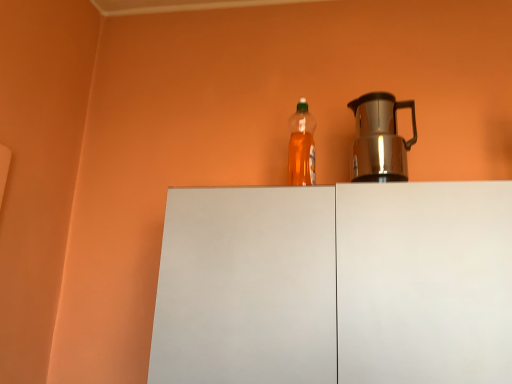
Question: From a real-world perspective, is white matte cabinet at center positioned above or below shiny metallic kettle at right?

Choices:
 (A) above
 (B) below

Answer: (B)

Question: Does point (508, 309) appear closer or farther from the camera than point (368, 127)?

Choices:
 (A) farther
 (B) closer

Answer: (B)

Question: Considering the real-world distances, which object is closest to the translucent plastic bottle at center?

Choices:
 (A) shiny metallic kettle at right
 (B) white matte cabinet at center

Answer: (A)

Question: Which object is the farthest from the translucent plastic bottle at center?

Choices:
 (A) white matte cabinet at center
 (B) shiny metallic kettle at right

Answer: (A)